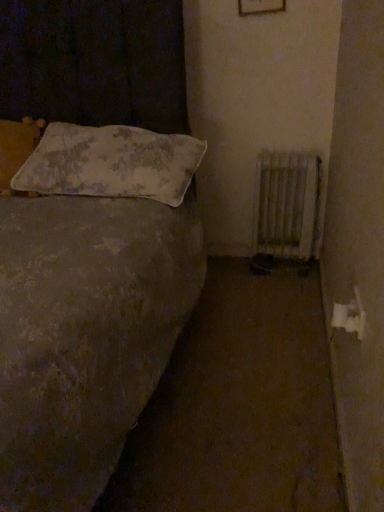
Question: Is fluffy white pillow at upper left, which ranks as the 2th pillow in left-to-right order, to the left of white metallic radiator at lower right from the viewer's perspective?

Choices:
 (A) no
 (B) yes

Answer: (B)

Question: Is fluffy white pillow at upper left, positioned as the 1th pillow in right-to-left order, positioned in front of white metallic radiator at lower right?

Choices:
 (A) yes
 (B) no

Answer: (A)

Question: Is fluffy white pillow at upper left, positioned as the 1th pillow in right-to-left order, smaller than white metallic radiator at lower right?

Choices:
 (A) no
 (B) yes

Answer: (A)

Question: Is fluffy white pillow at upper left, positioned as the 1th pillow in right-to-left order, completely or partially outside of white metallic radiator at lower right?

Choices:
 (A) yes
 (B) no

Answer: (A)

Question: Can you confirm if fluffy white pillow at upper left, which ranks as the 2th pillow in left-to-right order, is positioned to the right of white metallic radiator at lower right?

Choices:
 (A) yes
 (B) no

Answer: (B)

Question: Is fluffy white pillow at upper left, which ranks as the 2th pillow in left-to-right order, taller than white metallic radiator at lower right?

Choices:
 (A) yes
 (B) no

Answer: (B)

Question: Can you confirm if white metallic radiator at lower right is thinner than fluffy white pillow at upper left, positioned as the 1th pillow in right-to-left order?

Choices:
 (A) no
 (B) yes

Answer: (B)

Question: Is white metallic radiator at lower right wider than fluffy white pillow at upper left, positioned as the 1th pillow in right-to-left order?

Choices:
 (A) yes
 (B) no

Answer: (B)

Question: Is white metallic radiator at lower right aimed at fluffy white pillow at upper left, which ranks as the 2th pillow in left-to-right order?

Choices:
 (A) no
 (B) yes

Answer: (A)

Question: Is fluffy white pillow at upper left, positioned as the 1th pillow in right-to-left order, at the back of white metallic radiator at lower right?

Choices:
 (A) yes
 (B) no

Answer: (B)

Question: Can you see white metallic radiator at lower right touching fluffy white pillow at upper left, which ranks as the 2th pillow in left-to-right order?

Choices:
 (A) no
 (B) yes

Answer: (A)

Question: From a real-world perspective, is white metallic radiator at lower right positioned under fluffy white pillow at upper left, positioned as the 1th pillow in right-to-left order, based on gravity?

Choices:
 (A) no
 (B) yes

Answer: (B)

Question: From the image's perspective, is white metallic radiator at lower right located above fluffy white pillow at upper left, which ranks as the 1th pillow in left-to-right order?

Choices:
 (A) no
 (B) yes

Answer: (A)